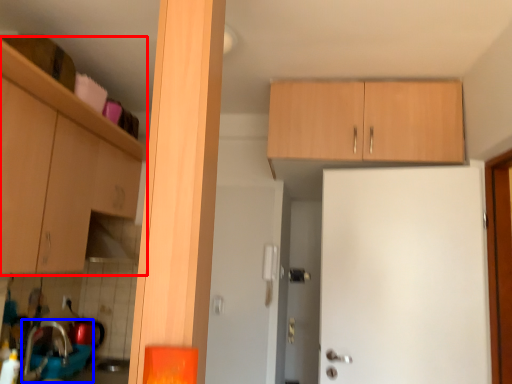
Question: Which object is closer to the camera taking this photo, cabinetry (highlighted by a red box) or sink (highlighted by a blue box)?

Choices:
 (A) cabinetry
 (B) sink

Answer: (A)